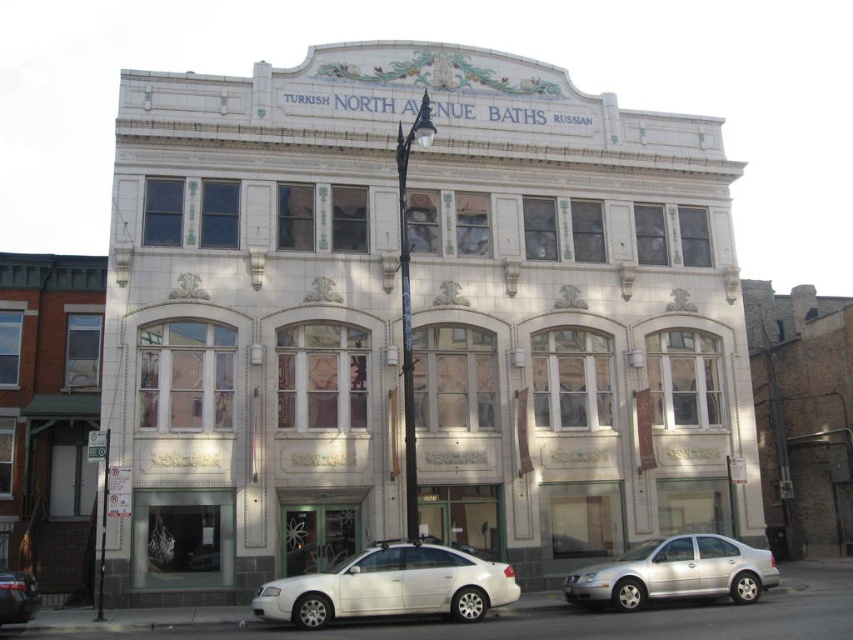
Is silver metallic sedan at lower right closer to the viewer compared to white glossy sedan at lower left?

No, silver metallic sedan at lower right is behind white glossy sedan at lower left.

Is silver metallic sedan at lower right smaller than white glossy sedan at lower left?

No.

Is point (656, 554) less distant than point (30, 611)?

That is False.

Locate an element on the screen. The image size is (853, 640). silver metallic sedan at lower right is located at coordinates (675, 572).

Can you confirm if white matte sedan at lower center is wider than white glossy sedan at lower left?

Correct, the width of white matte sedan at lower center exceeds that of white glossy sedan at lower left.

Can you confirm if white matte sedan at lower center is smaller than white glossy sedan at lower left?

No, white matte sedan at lower center is not smaller than white glossy sedan at lower left.

Find the location of a particular element. The image size is (853, 640). white matte sedan at lower center is located at coordinates (390, 586).

Where is `white matte sedan at lower center`? The image size is (853, 640). white matte sedan at lower center is located at coordinates (390, 586).

How much distance is there between white matte sedan at lower center and silver metallic sedan at lower right?

Result: The distance of white matte sedan at lower center from silver metallic sedan at lower right is 7.74 meters.

Who is higher up, white matte sedan at lower center or silver metallic sedan at lower right?

white matte sedan at lower center is above.

Is point (370, 560) positioned in front of point (619, 579)?

That is True.

Where is `white matte sedan at lower center`? The image size is (853, 640). white matte sedan at lower center is located at coordinates (390, 586).